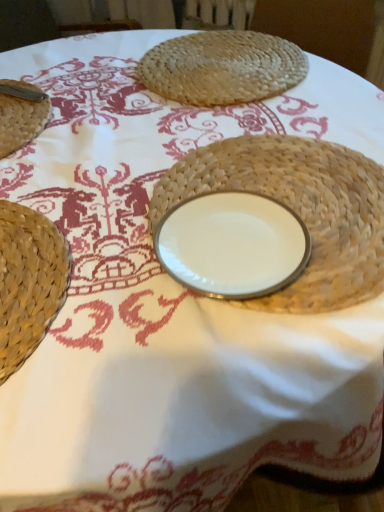
Identify the location of unoccupied area in front of woven straw placemat at upper center. (197, 131).